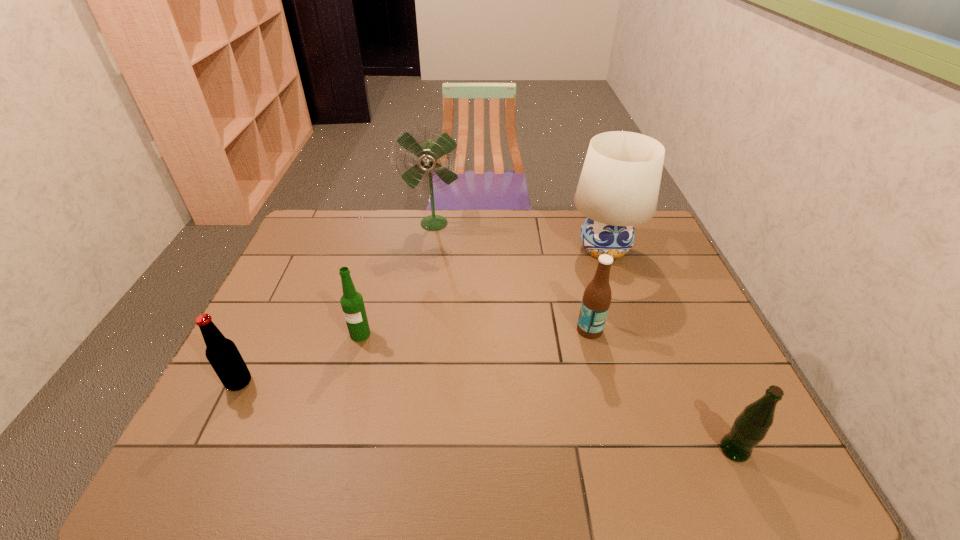
Find the location of `fan`. fan is located at coordinates (428, 153).

What are the coordinates of `lampshade` in the screenshot? It's located at (618, 188).

Locate an element on the screen. the third beer bottle from left to right is located at coordinates (596, 300).

Find the location of `the fifth object from right to left`. the fifth object from right to left is located at coordinates (352, 303).

This screenshot has width=960, height=540. I want to click on the fifth farthest object, so click(x=223, y=355).

At what (x,y) coordinates should I click in order to perform the action: click on the leftmost object. Please return your answer as a coordinate pair (x, y). The width and height of the screenshot is (960, 540). Looking at the image, I should click on (223, 355).

Locate an element on the screen. the nearest object is located at coordinates (750, 427).

Locate an element on the screen. Image resolution: width=960 pixels, height=540 pixels. the nearest beer bottle is located at coordinates (750, 427).

You are a GUI agent. You are given a task and a screenshot of the screen. Output one action in this format:
    pyautogui.click(x=<x>, y=<y>)
    Task: Click on the vacant region located 0.210m on the front-facing side of the fourth object from right to left
    Image resolution: width=960 pixels, height=540 pixels.
    Given the screenshot: What is the action you would take?
    pyautogui.click(x=427, y=272)

Locate an element on the screen. This screenshot has width=960, height=540. free space located on the front-facing side of the lampshade is located at coordinates (640, 354).